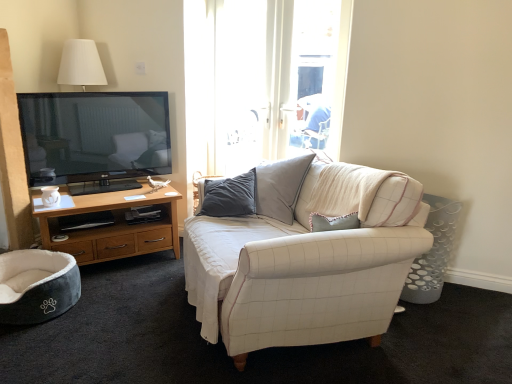
Where is `vacant space in between white fabric couch at center and gray plush pet bed at lower left`? The height and width of the screenshot is (384, 512). vacant space in between white fabric couch at center and gray plush pet bed at lower left is located at coordinates (129, 319).